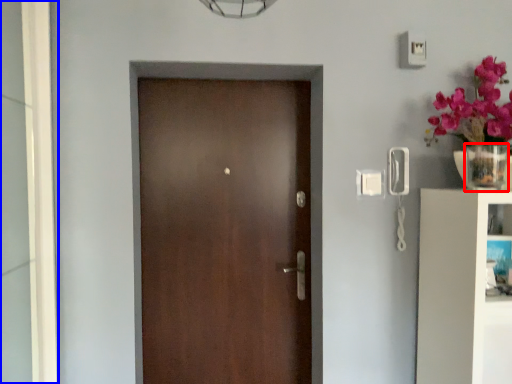
Question: Which point is closer to the camera, glass vase (highlighted by a red box) or glass door (highlighted by a blue box)?

Choices:
 (A) glass vase
 (B) glass door

Answer: (B)